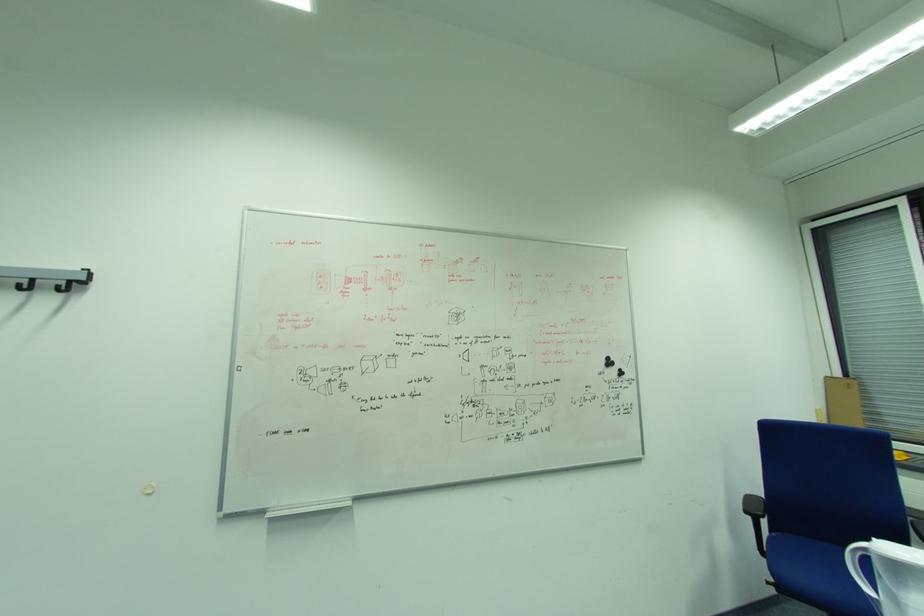
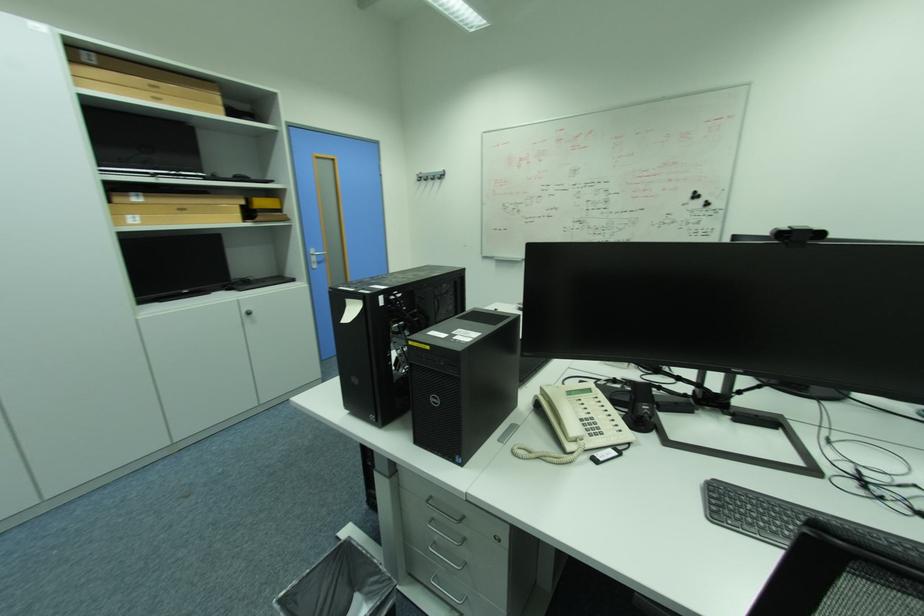
Locate, in the second image, the point that corresponds to point 67,265 in the first image.

(444, 169)